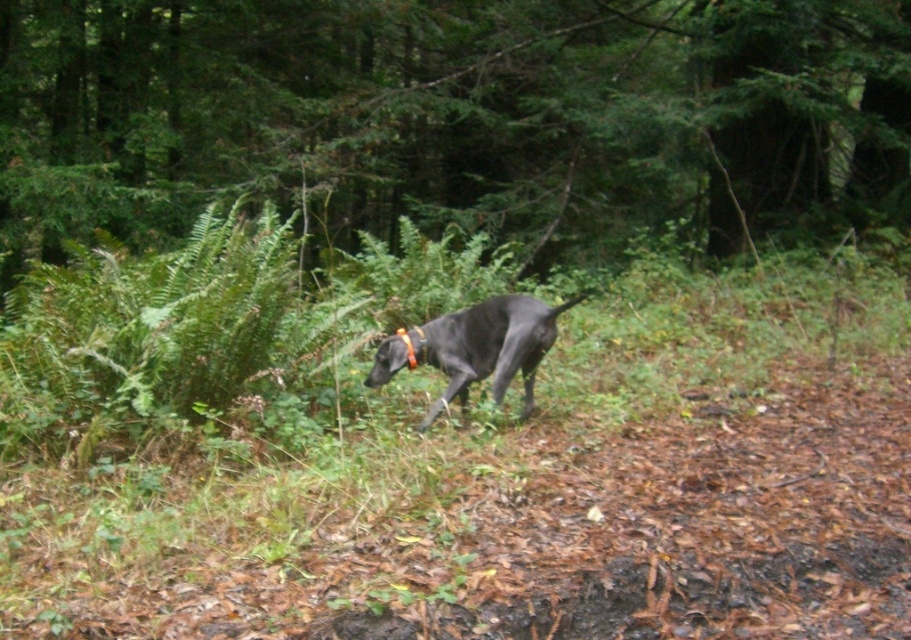
You are a hiker who wants to take a photo of the shiny black dog at center and the green leafy tree at center. Which object should you focus on first if you want to capture both in a single frame without moving the camera?

The green leafy tree at center is taller than the shiny black dog at center, so you should focus on the green leafy tree at center first to ensure both are in focus.

You are a hiker who wants to take a photo of the green leafy tree at center. Where should you position yourself to capture it in the frame?

To capture the green leafy tree at center in your photo, position yourself so that the tree is centered at the coordinates approximately 0.181 on the x axis and 0.494 on the y axis within the frame.